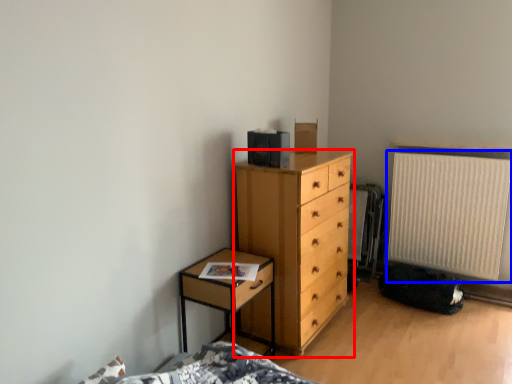
Question: Among these objects, which one is farthest to the camera, chest of drawers (highlighted by a red box) or radiator (highlighted by a blue box)?

Choices:
 (A) chest of drawers
 (B) radiator

Answer: (B)